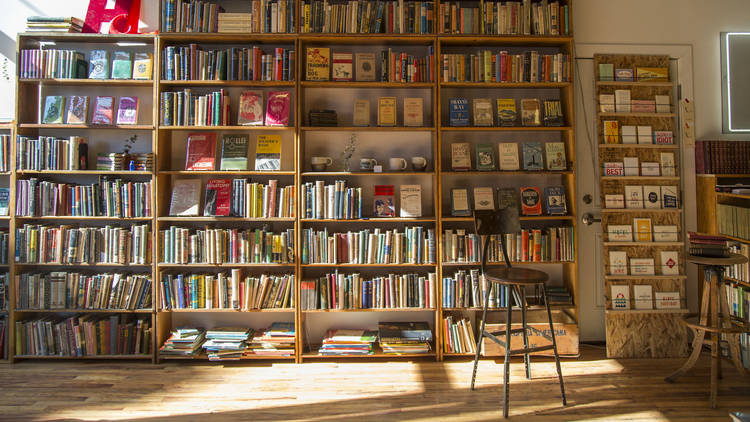
Find the location of a particular element. book shelves is located at coordinates (92, 190), (210, 175), (379, 180), (505, 179).